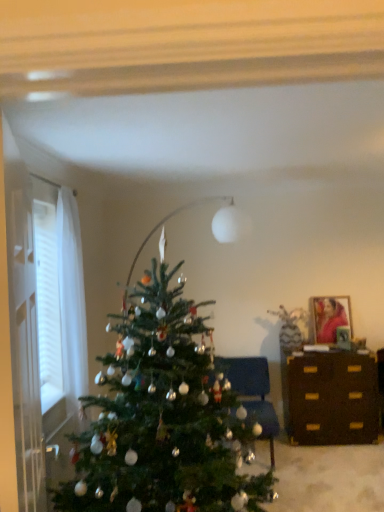
Question: Can you confirm if velvet blue chair at center is thinner than green matte christmas tree at center?

Choices:
 (A) yes
 (B) no

Answer: (A)

Question: Is velvet blue chair at center not close to green matte christmas tree at center?

Choices:
 (A) yes
 (B) no

Answer: (A)

Question: From a real-world perspective, is velvet blue chair at center on top of green matte christmas tree at center?

Choices:
 (A) yes
 (B) no

Answer: (B)

Question: Is velvet blue chair at center smaller than green matte christmas tree at center?

Choices:
 (A) no
 (B) yes

Answer: (B)

Question: Is the surface of velvet blue chair at center in direct contact with green matte christmas tree at center?

Choices:
 (A) yes
 (B) no

Answer: (B)

Question: Considering the relative sizes of velvet blue chair at center and green matte christmas tree at center in the image provided, is velvet blue chair at center taller than green matte christmas tree at center?

Choices:
 (A) no
 (B) yes

Answer: (A)

Question: Could you tell me if white sheer curtain at left is facing green matte christmas tree at center?

Choices:
 (A) no
 (B) yes

Answer: (B)

Question: Is white sheer curtain at left behind green matte christmas tree at center?

Choices:
 (A) no
 (B) yes

Answer: (A)

Question: Is white sheer curtain at left not close to green matte christmas tree at center?

Choices:
 (A) no
 (B) yes

Answer: (A)

Question: Is white sheer curtain at left directly adjacent to green matte christmas tree at center?

Choices:
 (A) yes
 (B) no

Answer: (B)

Question: Is white sheer curtain at left positioned with its back to green matte christmas tree at center?

Choices:
 (A) yes
 (B) no

Answer: (B)

Question: From a real-world perspective, is white sheer curtain at left located beneath green matte christmas tree at center?

Choices:
 (A) no
 (B) yes

Answer: (A)

Question: Can you confirm if matte wooden picture frame at upper right is smaller than dark brown wooden dresser at right?

Choices:
 (A) yes
 (B) no

Answer: (A)